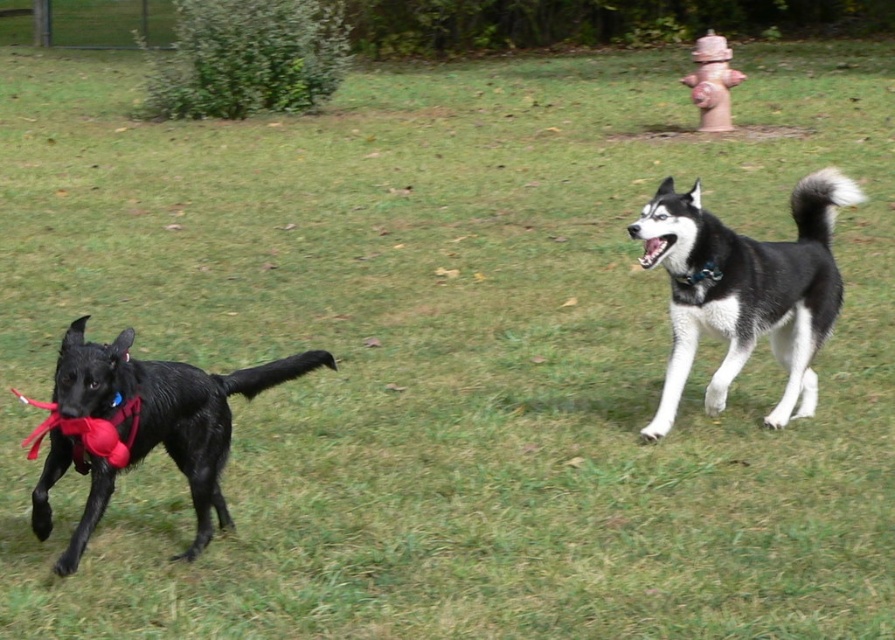
Question: Which point is farther to the camera?

Choices:
 (A) red cast iron fire hydrant at upper right
 (B) black and white fur dog at right

Answer: (A)

Question: Which object appears farthest from the camera in this image?

Choices:
 (A) white glossy teeth at upper center
 (B) shiny black dog at left
 (C) blue fabric neckband at left
 (D) black and white fur dog at right

Answer: (A)

Question: Considering the relative positions of blue fabric neckband at left and white glossy teeth at upper center in the image provided, where is blue fabric neckband at left located with respect to white glossy teeth at upper center?

Choices:
 (A) left
 (B) right

Answer: (A)

Question: Which of the following is the closest to the observer?

Choices:
 (A) shiny black dog at left
 (B) red cast iron fire hydrant at upper right
 (C) blue fabric neckband at left
 (D) black and white fur dog at right

Answer: (C)

Question: Can you confirm if shiny black dog at left is smaller than red cast iron fire hydrant at upper right?

Choices:
 (A) no
 (B) yes

Answer: (A)

Question: Is black and white fur dog at right positioned at the back of shiny black dog at left?

Choices:
 (A) yes
 (B) no

Answer: (A)